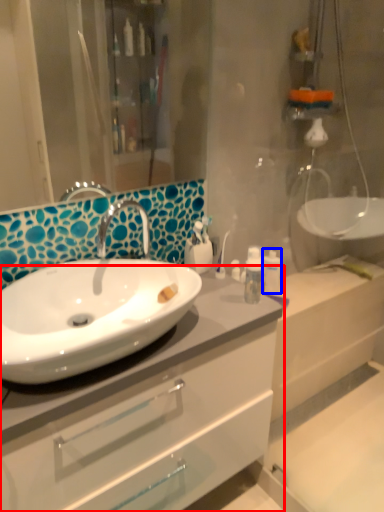
Question: Which object is closer to the camera taking this photo, bathroom cabinet (highlighted by a red box) or toiletry (highlighted by a blue box)?

Choices:
 (A) bathroom cabinet
 (B) toiletry

Answer: (A)